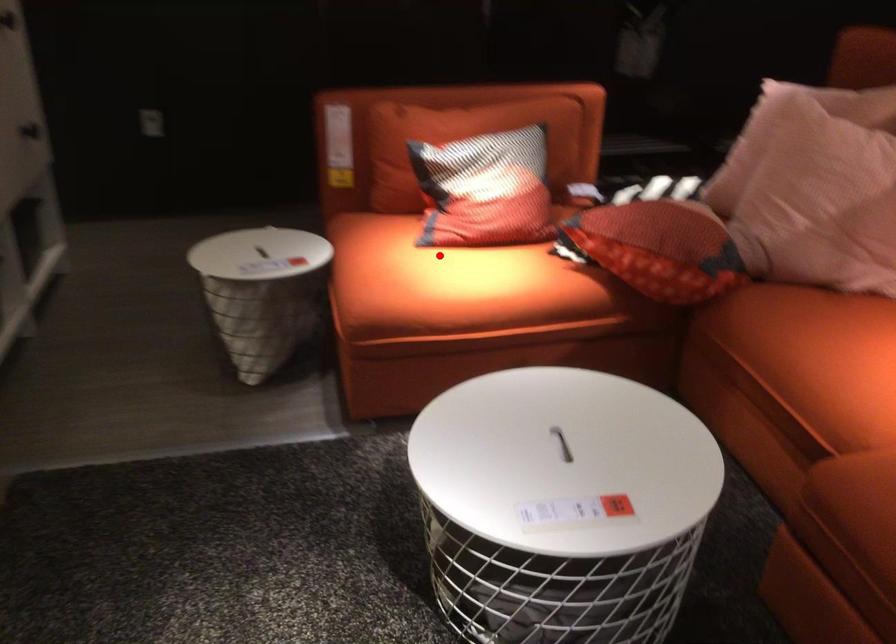
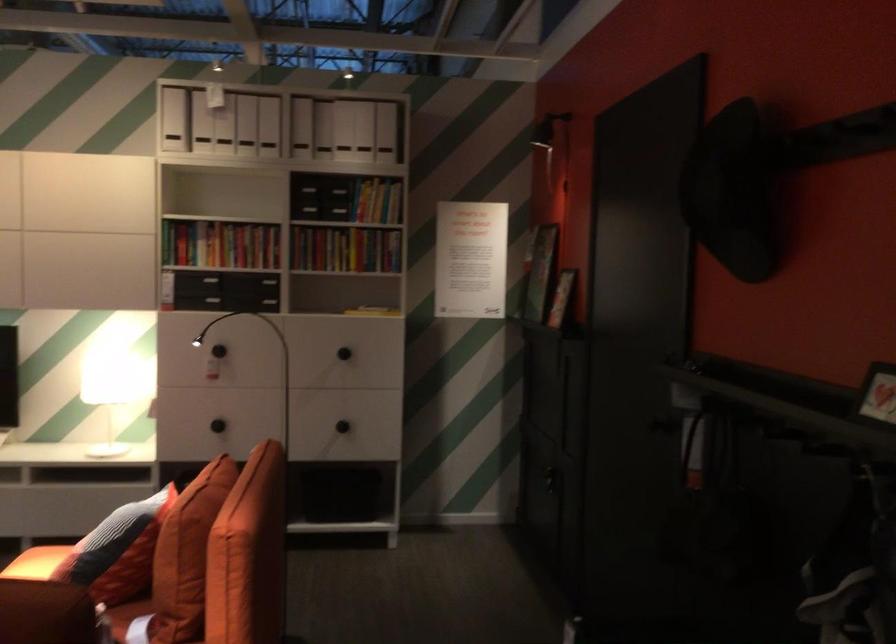
Locate, in the second image, the point that corresponds to the highlighted location in the first image.

(36, 563)